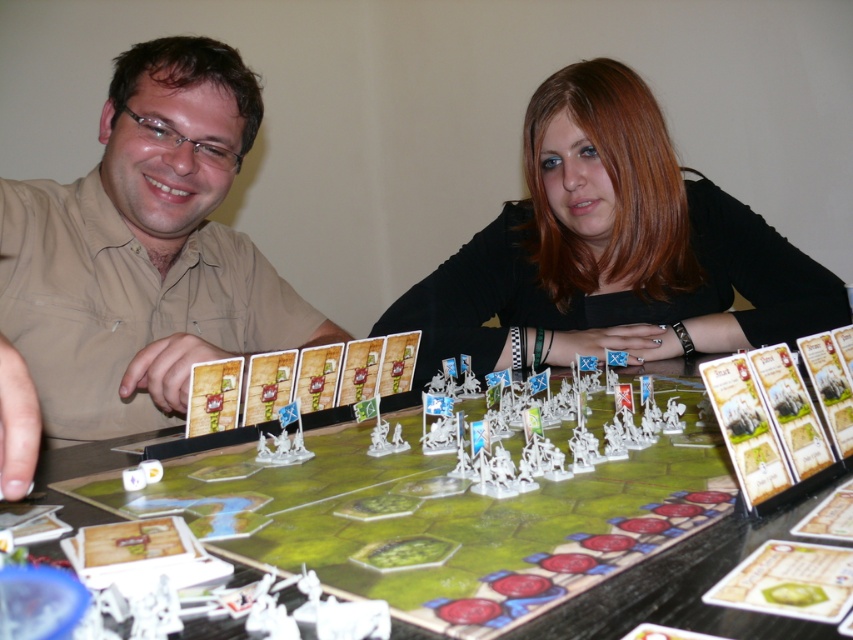
You are a game piece that is 1.5 inches wide. You are currently positioned at the matte plastic figures at center and want to move to the matte beige shirt at left. Can you fit through the space between them?

The distance between the matte plastic figures at center and the matte beige shirt at left is 3.40 inches. Since the game piece is 1.5 inches wide, it can easily fit through the space between them as there is sufficient clearance.

Based on the scene description, where exactly are the matte plastic figures at center located in terms of their 2D coordinates?

The matte plastic figures at center are located at the 2D coordinates point [140,260].